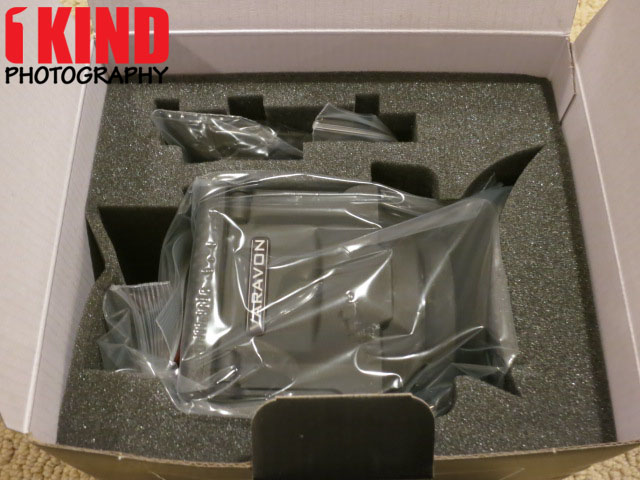
The height and width of the screenshot is (480, 640). I want to click on box, so click(608, 140), click(396, 51), click(51, 156), click(355, 448).